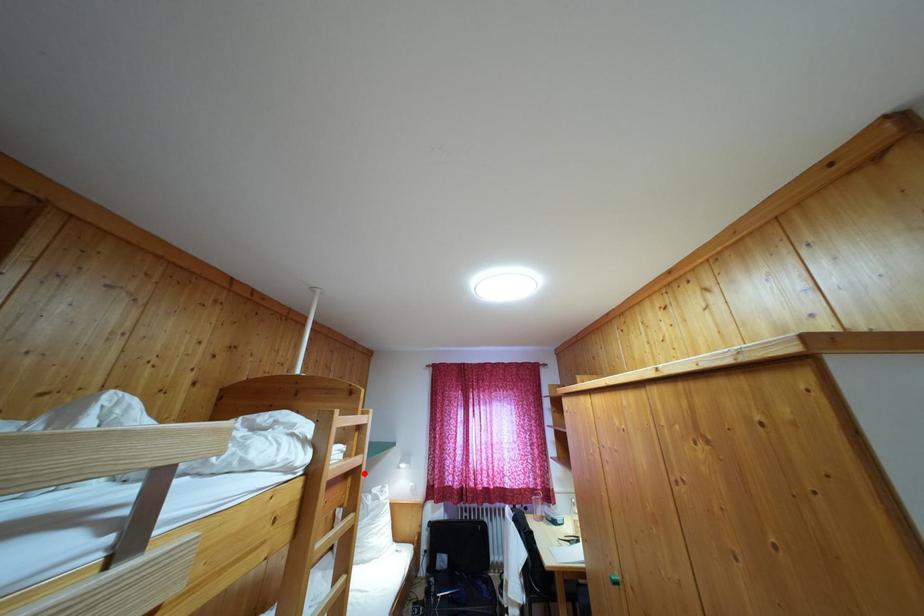
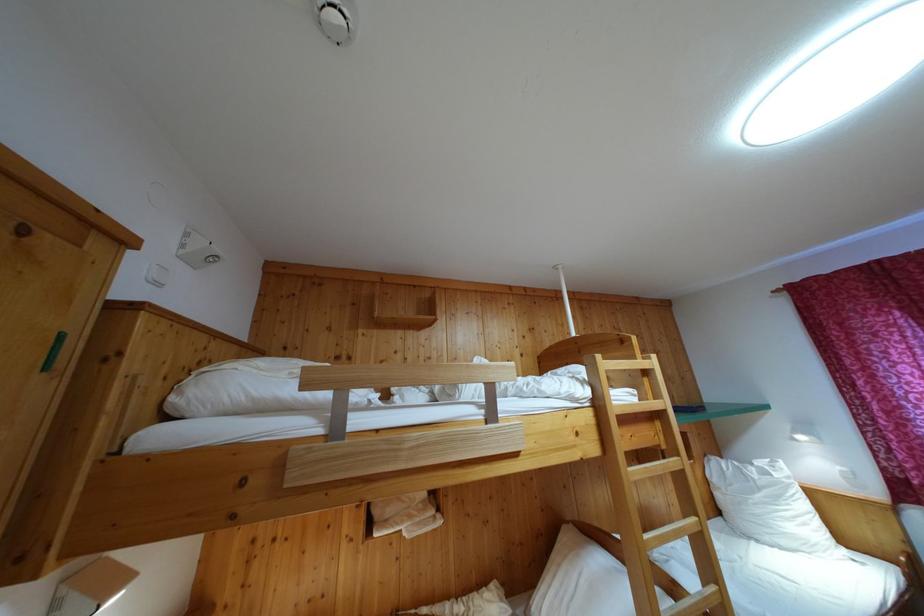
The point at the highlighted location is marked in the first image. Where is the corresponding point in the second image?

(669, 418)